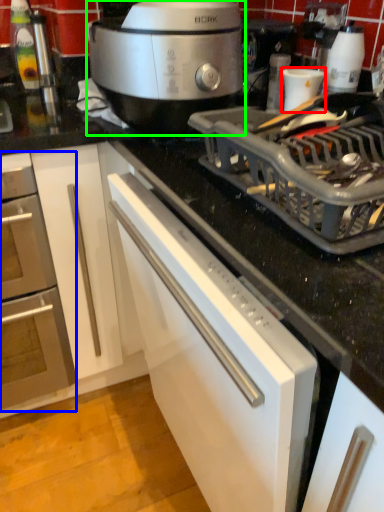
Question: Based on their relative distances, which object is farther from appliance (highlighted by a red box)? Choose from home appliance (highlighted by a blue box) and slow cooker (highlighted by a green box).

Choices:
 (A) home appliance
 (B) slow cooker

Answer: (A)